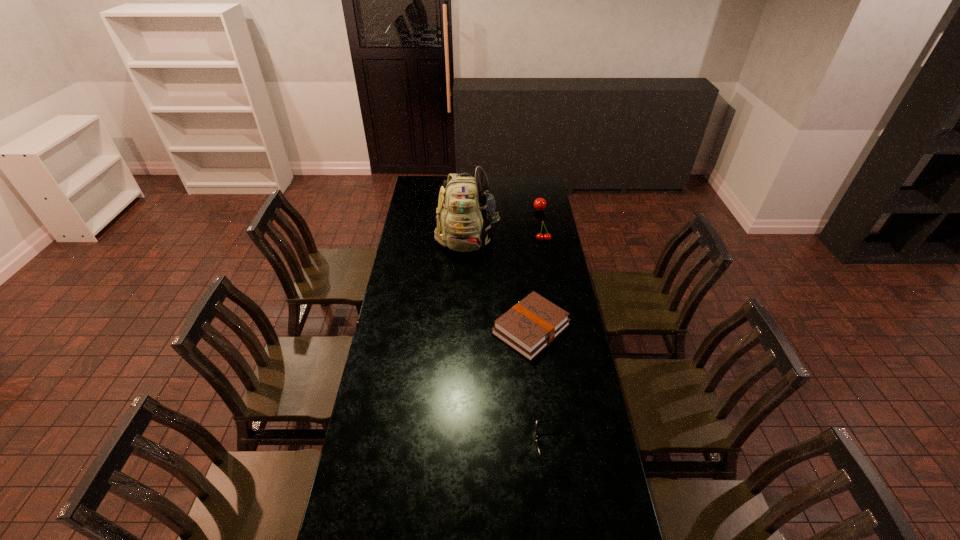
Where is `free spot located on the back of the third tallest object`? The width and height of the screenshot is (960, 540). free spot located on the back of the third tallest object is located at coordinates (536, 191).

This screenshot has width=960, height=540. I want to click on vacant space located on the back of the hardback book, so point(525,275).

Locate an element on the screen. The height and width of the screenshot is (540, 960). vacant space located 0.310m on the front-facing side of the shortest object is located at coordinates 443,446.

Find the location of a particular element. The height and width of the screenshot is (540, 960). free space located on the front-facing side of the shortest object is located at coordinates (469, 446).

I want to click on free space located on the front-facing side of the shortest object, so click(x=431, y=446).

Image resolution: width=960 pixels, height=540 pixels. I want to click on hardback book at the right edge, so click(529, 326).

Image resolution: width=960 pixels, height=540 pixels. I want to click on spectacles at the right edge, so click(x=537, y=421).

Locate an element on the screen. The width and height of the screenshot is (960, 540). vacant space at the left edge of the desktop is located at coordinates (425, 251).

The height and width of the screenshot is (540, 960). In the image, there is a desktop. In order to click on vacant space at the right edge in this screenshot , I will do `click(535, 237)`.

The width and height of the screenshot is (960, 540). Find the location of `vacant area between the shorter cherry and the tallest object`. vacant area between the shorter cherry and the tallest object is located at coordinates (504, 224).